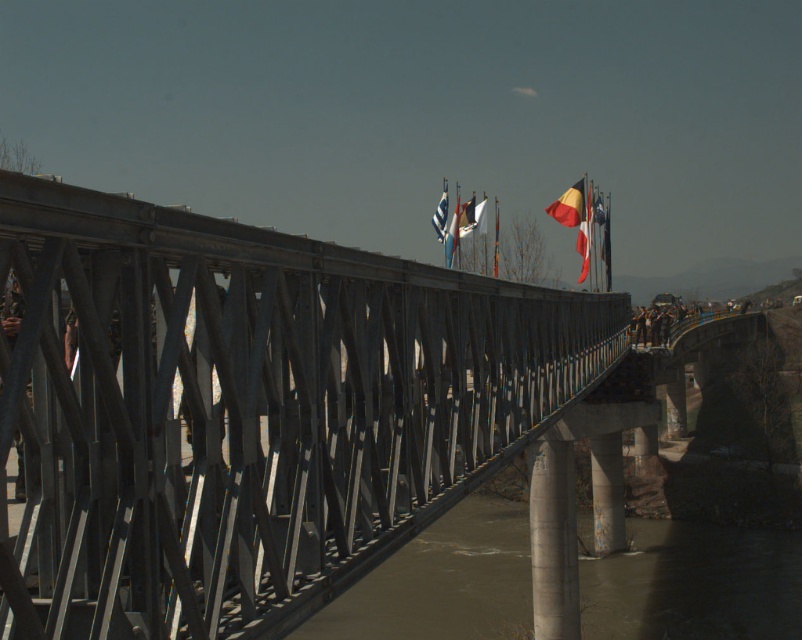
Question: Does metallic bridge at center have a smaller size compared to red fabric flag at upper right?

Choices:
 (A) yes
 (B) no

Answer: (A)

Question: Estimate the real-world distances between objects in this image. Which object is farther from the brown muddy water at center?

Choices:
 (A) red and yellow striped flag at center
 (B) metallic bridge at center
 (C) white fabric flag at center

Answer: (A)

Question: In this image, where is metallic bridge at center located relative to red and yellow striped flag at center?

Choices:
 (A) above
 (B) below

Answer: (B)

Question: Estimate the real-world distances between objects in this image. Which object is farther from the metallic bridge at center?

Choices:
 (A) red fabric flag at upper right
 (B) brown muddy water at center
 (C) white fabric flag at center

Answer: (C)

Question: Is brown muddy water at center smaller than red and yellow striped flag at center?

Choices:
 (A) no
 (B) yes

Answer: (A)

Question: Which point is closer to the camera taking this photo?

Choices:
 (A) (444, 186)
 (B) (582, 216)
 (C) (82, 616)
 (D) (585, 196)

Answer: (C)